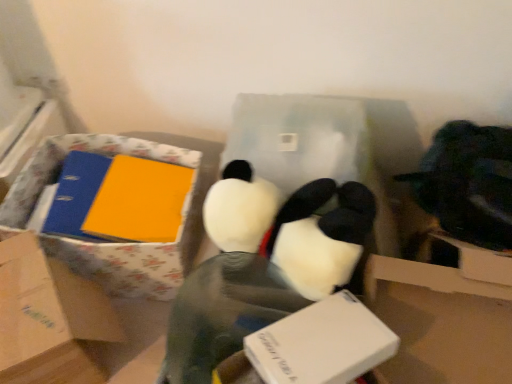
Question: Is matte yellow book at left inside floral-patterned cardboard box at left?

Choices:
 (A) no
 (B) yes

Answer: (B)

Question: Is the depth of floral-patterned cardboard box at left greater than that of matte yellow book at left?

Choices:
 (A) yes
 (B) no

Answer: (B)

Question: Can you confirm if floral-patterned cardboard box at left is shorter than matte yellow book at left?

Choices:
 (A) yes
 (B) no

Answer: (B)

Question: Is floral-patterned cardboard box at left wider than matte yellow book at left?

Choices:
 (A) yes
 (B) no

Answer: (A)

Question: From a real-world perspective, does floral-patterned cardboard box at left stand above matte yellow book at left?

Choices:
 (A) yes
 (B) no

Answer: (A)

Question: Does floral-patterned cardboard box at left appear on the left side of matte yellow book at left?

Choices:
 (A) no
 (B) yes

Answer: (B)

Question: Is white plastic box at center, acting as the first box starting from the right, completely or partially inside white plush toy at center?

Choices:
 (A) no
 (B) yes

Answer: (A)

Question: Is white plush toy at center taller than white plastic box at center, acting as the first box starting from the right?

Choices:
 (A) no
 (B) yes

Answer: (B)

Question: Is white plush toy at center to the left of white plastic box at center, placed as the second box when sorted from left to right, from the viewer's perspective?

Choices:
 (A) yes
 (B) no

Answer: (A)

Question: Is white plush toy at center looking in the opposite direction of white plastic box at center, placed as the second box when sorted from left to right?

Choices:
 (A) yes
 (B) no

Answer: (B)

Question: Is white plush toy at center completely or partially outside of white plastic box at center, acting as the first box starting from the right?

Choices:
 (A) no
 (B) yes

Answer: (B)

Question: Is white plush toy at center directly adjacent to white plastic box at center, acting as the first box starting from the right?

Choices:
 (A) yes
 (B) no

Answer: (B)

Question: Considering the relative positions of floral-patterned cardboard box at left and matte cardboard box at left, the 2th box positioned from the right, in the image provided, is floral-patterned cardboard box at left to the right of matte cardboard box at left, the 2th box positioned from the right, from the viewer's perspective?

Choices:
 (A) yes
 (B) no

Answer: (A)